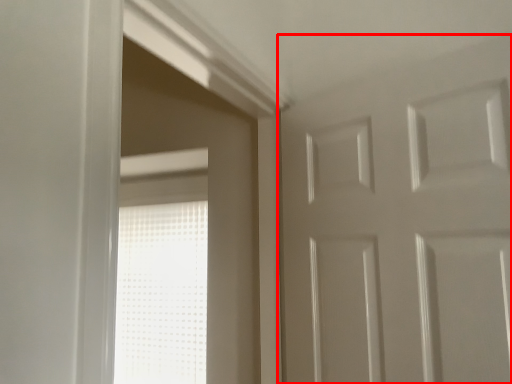
Question: From the image, what is the correct spatial relationship of door (annotated by the red box) in relation to window?

Choices:
 (A) right
 (B) left

Answer: (A)